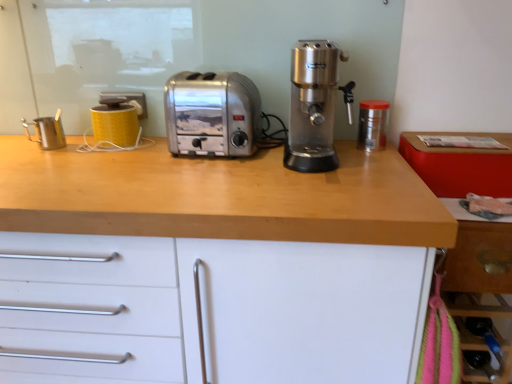
You are a GUI agent. You are given a task and a screenshot of the screen. Output one action in this format:
    pyautogui.click(x=<x>, y=<y>)
    Task: Click on the free spot to the left of metallic stainless steel pitcher at left, which ranks as the first kitchen appliance in left-to-right order
    The height and width of the screenshot is (384, 512).
    Given the screenshot: What is the action you would take?
    pyautogui.click(x=16, y=140)